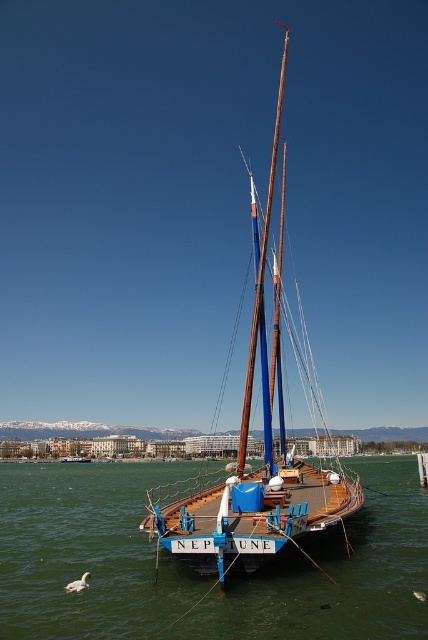
Question: Estimate the real-world distances between objects in this image. Which object is closer to the wooden sailboat at center?

Choices:
 (A) brown wooden mast at center
 (B) greenish water at center

Answer: (A)

Question: Does greenish water at center appear on the right side of wooden sailboat at center?

Choices:
 (A) no
 (B) yes

Answer: (A)

Question: Observing the image, what is the correct spatial positioning of greenish water at center in reference to brown wooden mast at center?

Choices:
 (A) below
 (B) above

Answer: (A)

Question: Estimate the real-world distances between objects in this image. Which object is farther from the greenish water at center?

Choices:
 (A) brown wooden mast at center
 (B) wooden sailboat at center

Answer: (B)

Question: Can you confirm if wooden sailboat at center is positioned above brown wooden mast at center?

Choices:
 (A) yes
 (B) no

Answer: (B)

Question: Considering the real-world distances, which object is closest to the wooden sailboat at center?

Choices:
 (A) brown wooden mast at center
 (B) greenish water at center

Answer: (A)